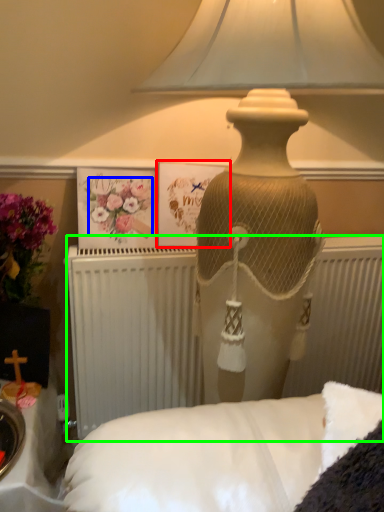
Question: Which object is the closest to the postcard (highlighted by a red box)? Choose among these: flower (highlighted by a blue box) or radiator (highlighted by a green box).

Choices:
 (A) flower
 (B) radiator

Answer: (A)